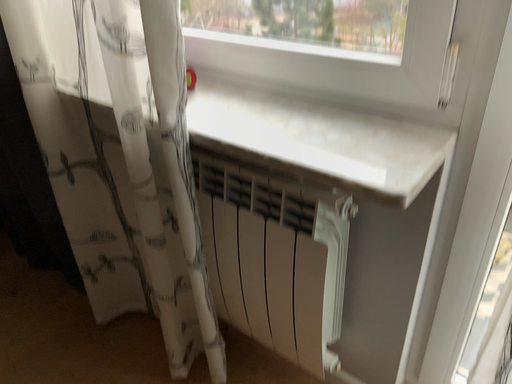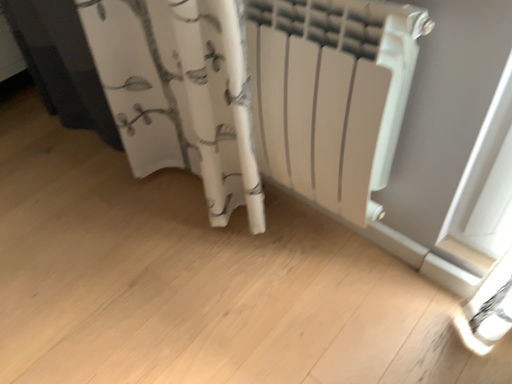
Question: Which way did the camera rotate in the video?

Choices:
 (A) rotated downward
 (B) rotated upward

Answer: (A)